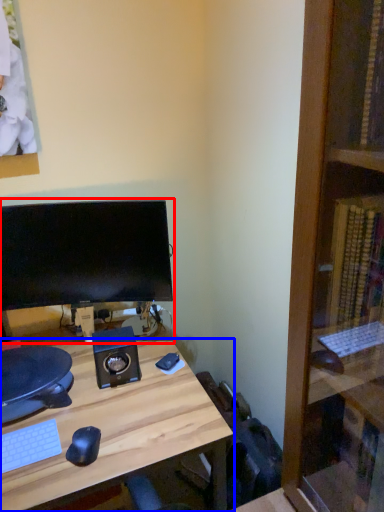
Question: Which of the following is the closest to the observer, computer monitor (highlighted by a red box) or desk (highlighted by a blue box)?

Choices:
 (A) computer monitor
 (B) desk

Answer: (B)